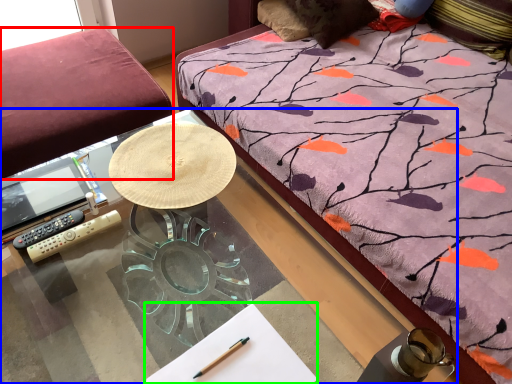
Question: Which is farther away from studio couch (highlighted by a red box)? desk (highlighted by a blue box) or notepad (highlighted by a green box)?

Choices:
 (A) desk
 (B) notepad

Answer: (B)